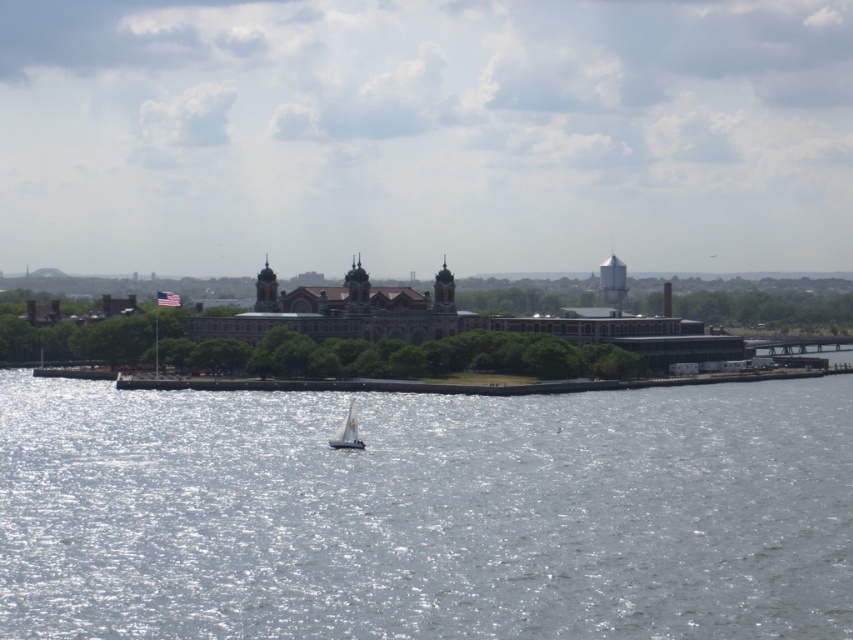
Question: Is reflective silver water at center thinner than white sailboat at center?

Choices:
 (A) no
 (B) yes

Answer: (A)

Question: Which of the following is the farthest from the observer?

Choices:
 (A) (239, 440)
 (B) (341, 429)

Answer: (A)

Question: Which of the following is the closest to the observer?

Choices:
 (A) (357, 428)
 (B) (314, 593)

Answer: (B)

Question: Can you confirm if reflective silver water at center is smaller than white sailboat at center?

Choices:
 (A) yes
 (B) no

Answer: (B)

Question: Is reflective silver water at center positioned in front of white sailboat at center?

Choices:
 (A) yes
 (B) no

Answer: (A)